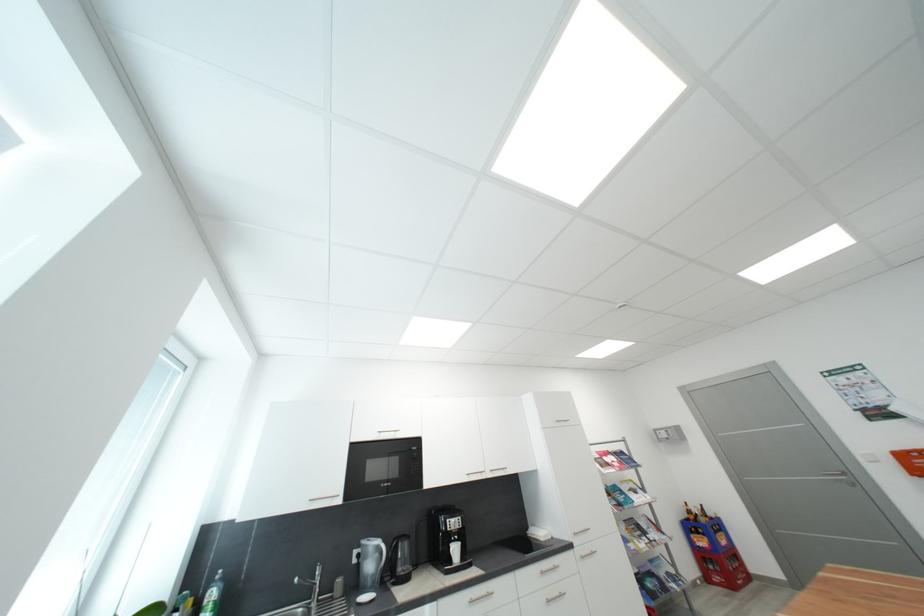
Where would you pull the silver door handle? Please return your answer as a coordinate pair (x, y).

(852, 546)